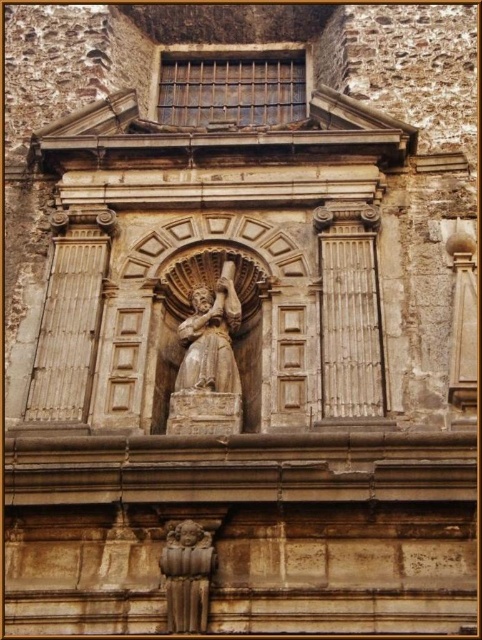
Who is positioned more to the right, rusty metal window at upper center or brown stone cherub at lower center?

From the viewer's perspective, rusty metal window at upper center appears more on the right side.

Consider the image. Can you confirm if rusty metal window at upper center is positioned to the left of brown stone cherub at lower center?

In fact, rusty metal window at upper center is to the right of brown stone cherub at lower center.

Which is in front, point (225, 54) or point (187, 568)?

Point (187, 568)

This screenshot has width=482, height=640. I want to click on rusty metal window at upper center, so pos(231,88).